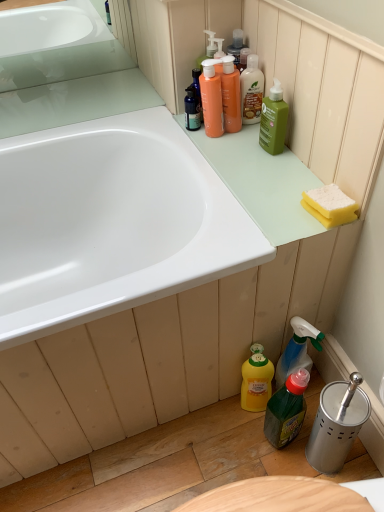
Find the location of `free spot to the left of matte orange pump bottles at upper center, the fourth cleaning product positioned from the bottom`. free spot to the left of matte orange pump bottles at upper center, the fourth cleaning product positioned from the bottom is located at coordinates (172, 129).